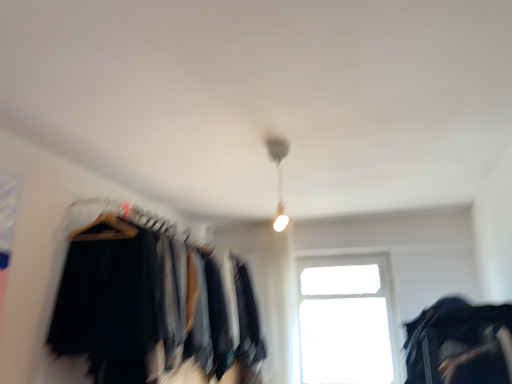
This screenshot has height=384, width=512. Describe the element at coordinates (348, 320) in the screenshot. I see `transparent glass window at center` at that location.

The image size is (512, 384). Describe the element at coordinates (460, 344) in the screenshot. I see `black fabric bag at lower right` at that location.

Image resolution: width=512 pixels, height=384 pixels. What do you see at coordinates (153, 301) in the screenshot?
I see `black fabric clothes at left` at bounding box center [153, 301].

Identify the location of transparent glass window at center. (348, 320).

Is point (278, 221) closer to camera compared to point (357, 323)?

Yes.

Based on the photo, measure the distance between white glossy lamp at upper center and transparent glass window at center.

The distance of white glossy lamp at upper center from transparent glass window at center is 5.05 feet.

In terms of size, does white glossy lamp at upper center appear bigger or smaller than transparent glass window at center?

Considering their sizes, white glossy lamp at upper center takes up less space than transparent glass window at center.

Can you tell me how much white glossy lamp at upper center and transparent glass window at center differ in facing direction?

The angle between the facing direction of white glossy lamp at upper center and the facing direction of transparent glass window at center is 0.0591 degrees.

Looking at this image, from the image's perspective, is transparent glass window at center located above white glossy lamp at upper center?

Incorrect, from the image's perspective, transparent glass window at center is lower than white glossy lamp at upper center.

Is transparent glass window at center next to white glossy lamp at upper center and touching it?

No, transparent glass window at center is not in contact with white glossy lamp at upper center.

Who is taller, transparent glass window at center or white glossy lamp at upper center?

With more height is transparent glass window at center.

Can you confirm if white glossy lamp at upper center is smaller than black fabric bag at lower right?

Correct, white glossy lamp at upper center occupies less space than black fabric bag at lower right.

Is the position of white glossy lamp at upper center more distant than that of black fabric bag at lower right?

Yes, the depth of white glossy lamp at upper center is greater than that of black fabric bag at lower right.

From the image's perspective, is white glossy lamp at upper center located beneath black fabric bag at lower right?

Incorrect, from the image's perspective, white glossy lamp at upper center is higher than black fabric bag at lower right.

How far apart are white glossy lamp at upper center and black fabric bag at lower right?

white glossy lamp at upper center is 4.03 feet from black fabric bag at lower right.

Considering the sizes of objects black fabric bag at lower right and white glossy lamp at upper center in the image provided, who is shorter, black fabric bag at lower right or white glossy lamp at upper center?

With less height is black fabric bag at lower right.

Which is more to the right, black fabric bag at lower right or white glossy lamp at upper center?

black fabric bag at lower right.

From the image's perspective, which is below, black fabric bag at lower right or white glossy lamp at upper center?

black fabric bag at lower right.

Does black fabric clothes at left have a smaller size compared to black fabric bag at lower right?

Incorrect, black fabric clothes at left is not smaller in size than black fabric bag at lower right.

I want to click on clothing located above the black fabric clothes at left (from the image's perspective), so click(x=460, y=344).

Is black fabric clothes at left further to the viewer compared to black fabric bag at lower right?

Yes, it is behind black fabric bag at lower right.

Is black fabric clothes at left positioned far away from black fabric bag at lower right?

Indeed, black fabric clothes at left is not near black fabric bag at lower right.

Would you say black fabric bag at lower right is a long distance from black fabric clothes at left?

black fabric bag at lower right is far away from black fabric clothes at left.

Considering the sizes of black fabric bag at lower right and black fabric clothes at left in the image, is black fabric bag at lower right bigger or smaller than black fabric clothes at left?

In the image, black fabric bag at lower right appears to be smaller than black fabric clothes at left.

What's the angular difference between black fabric bag at lower right and black fabric clothes at left's facing directions?

There is a 180-degree angle between the facing directions of black fabric bag at lower right and black fabric clothes at left.

From a real-world perspective, which is physically below, white glossy lamp at upper center or black fabric clothes at left?

black fabric clothes at left.

Is white glossy lamp at upper center placed right next to black fabric clothes at left?

No, white glossy lamp at upper center is not making contact with black fabric clothes at left.

Can you confirm if white glossy lamp at upper center is thinner than black fabric clothes at left?

Correct, the width of white glossy lamp at upper center is less than that of black fabric clothes at left.

Does white glossy lamp at upper center have a greater height compared to black fabric clothes at left?

No.

What are the coordinates of `lamp in front of the transparent glass window at center` in the screenshot? It's located at (279, 177).

You are a GUI agent. You are given a task and a screenshot of the screen. Output one action in this format:
    pyautogui.click(x=<x>, y=<y>)
    Task: Click on the lamp above the transparent glass window at center (from a real-world perspective)
    The height and width of the screenshot is (384, 512).
    Given the screenshot: What is the action you would take?
    tap(279, 177)

Estimate the real-world distances between objects in this image. Which object is closer to black fabric bag at lower right, black fabric clothes at left or transparent glass window at center?

Based on the image, black fabric clothes at left appears to be nearer to black fabric bag at lower right.

Considering their positions, is black fabric bag at lower right positioned closer to white glossy lamp at upper center than black fabric clothes at left?

Among the two, black fabric clothes at left is located nearer to white glossy lamp at upper center.

Considering their positions, is transparent glass window at center positioned further to black fabric bag at lower right than black fabric clothes at left?

transparent glass window at center.

Which object lies nearer to the anchor point white glossy lamp at upper center, black fabric clothes at left or black fabric bag at lower right?

Based on the image, black fabric clothes at left appears to be nearer to white glossy lamp at upper center.

Which object lies further to the anchor point black fabric bag at lower right, black fabric clothes at left or white glossy lamp at upper center?

Among the two, black fabric clothes at left is located further to black fabric bag at lower right.

Looking at the image, which one is located further to transparent glass window at center, black fabric bag at lower right or white glossy lamp at upper center?

The object further to transparent glass window at center is black fabric bag at lower right.

Consider the image. Based on their spatial positions, is white glossy lamp at upper center or black fabric clothes at left further from transparent glass window at center?

white glossy lamp at upper center is positioned further to the anchor transparent glass window at center.

Estimate the real-world distances between objects in this image. Which object is closer to transparent glass window at center, black fabric clothes at left or white glossy lamp at upper center?

black fabric clothes at left is positioned closer to the anchor transparent glass window at center.

Identify the location of lamp between black fabric bag at lower right and transparent glass window at center from front to back. (279, 177).

Where is `closet between black fabric bag at lower right and transparent glass window at center from front to back`? closet between black fabric bag at lower right and transparent glass window at center from front to back is located at coordinates (153, 301).

Locate an element on the screen. The image size is (512, 384). lamp between black fabric clothes at left and black fabric bag at lower right in the horizontal direction is located at coordinates (279, 177).

Identify the location of lamp located between black fabric clothes at left and transparent glass window at center in the depth direction. (279, 177).